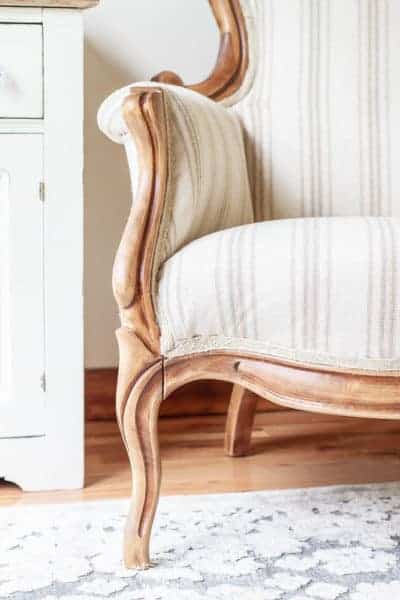
Locate an element on the screen. area rug is located at coordinates (189, 550).